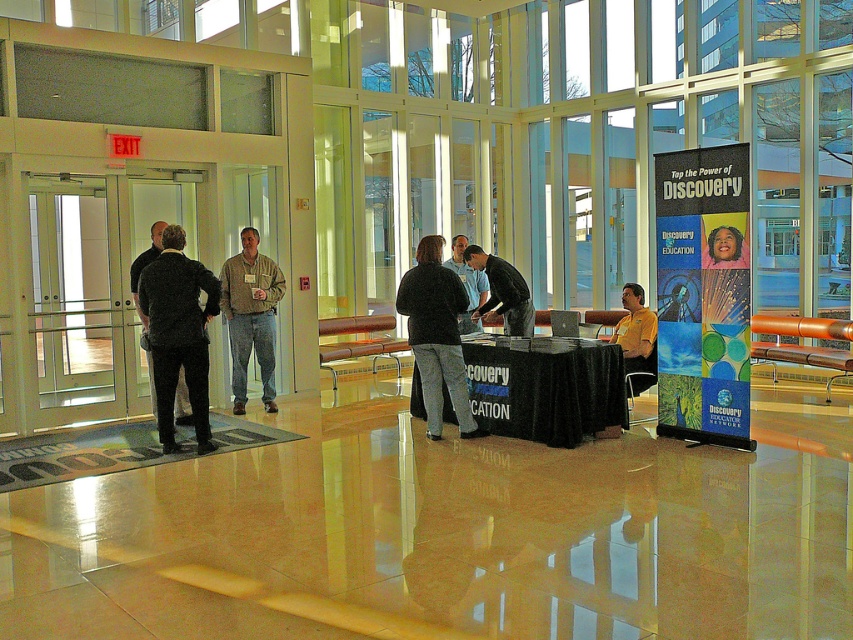
Question: Among these objects, which one is nearest to the camera?

Choices:
 (A) dark gray sweater at center
 (B) khaki cotton shirt at center

Answer: (A)

Question: Can you confirm if khaki cotton shirt at center is positioned above black clothed table at center?

Choices:
 (A) no
 (B) yes

Answer: (B)

Question: Which object appears farthest from the camera in this image?

Choices:
 (A) dark gray suit at left
 (B) khaki cotton shirt at center
 (C) dark blue sweater at center
 (D) black clothed table at center

Answer: (C)

Question: Which point is farther to the camera?

Choices:
 (A) (432, 360)
 (B) (463, 237)

Answer: (B)

Question: Is black shirt at center positioned behind dark gray suit at left?

Choices:
 (A) yes
 (B) no

Answer: (A)

Question: Can you confirm if black shirt at center is wider than dark blue sweater at center?

Choices:
 (A) yes
 (B) no

Answer: (A)